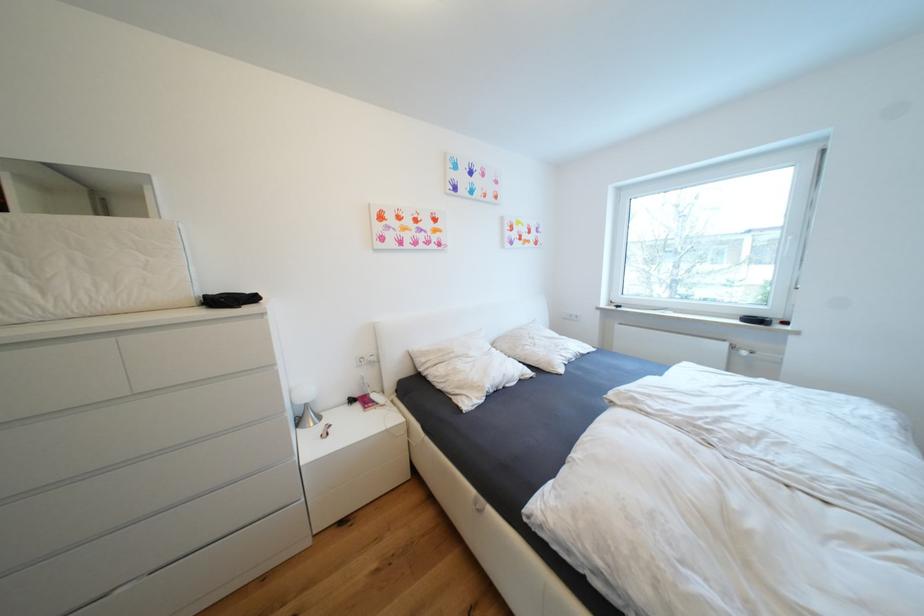
The image size is (924, 616). What do you see at coordinates (228, 300) in the screenshot?
I see `a black pouch` at bounding box center [228, 300].